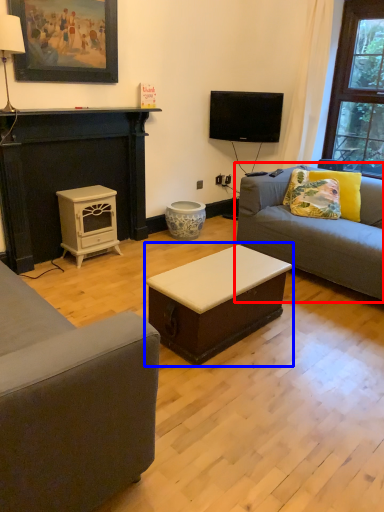
Question: Which point is closer to the camera, studio couch (highlighted by a red box) or table (highlighted by a blue box)?

Choices:
 (A) studio couch
 (B) table

Answer: (B)